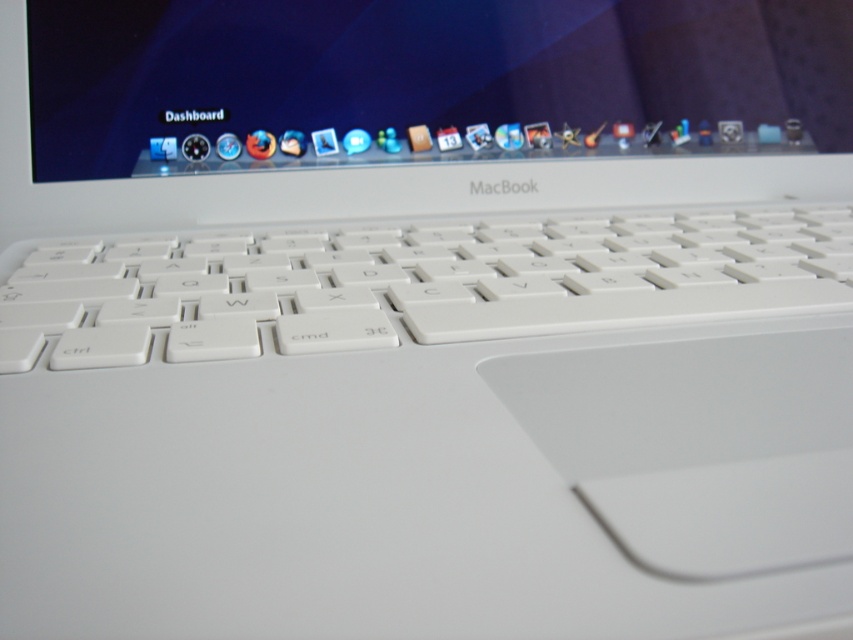
Question: Where is glossy plastic computer screen at upper center located in relation to white plastic keyboard at center in the image?

Choices:
 (A) above
 (B) below

Answer: (A)

Question: Can you confirm if glossy plastic computer screen at upper center is positioned above white plastic keyboard at center?

Choices:
 (A) yes
 (B) no

Answer: (A)

Question: In this image, where is glossy plastic computer screen at upper center located relative to white plastic keyboard at center?

Choices:
 (A) right
 (B) left

Answer: (B)

Question: Which object is farther from the camera taking this photo?

Choices:
 (A) white plastic keyboard at center
 (B) glossy plastic computer screen at upper center

Answer: (B)